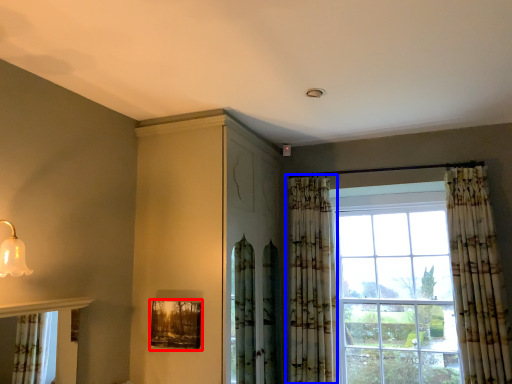
Question: Which object is closer to the camera taking this photo, picture frame (highlighted by a red box) or curtain (highlighted by a blue box)?

Choices:
 (A) picture frame
 (B) curtain

Answer: (A)